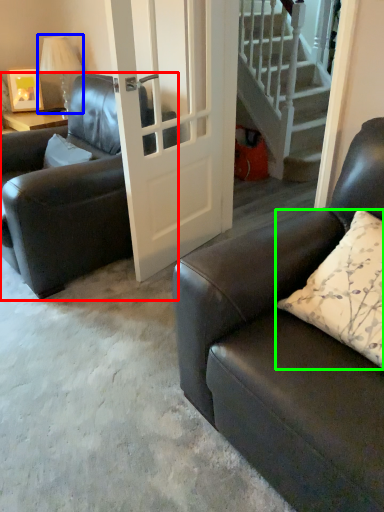
Question: Based on their relative distances, which object is farther from chair (highlighted by a red box)? Choose from lamp (highlighted by a blue box) and pillow (highlighted by a green box).

Choices:
 (A) lamp
 (B) pillow

Answer: (B)